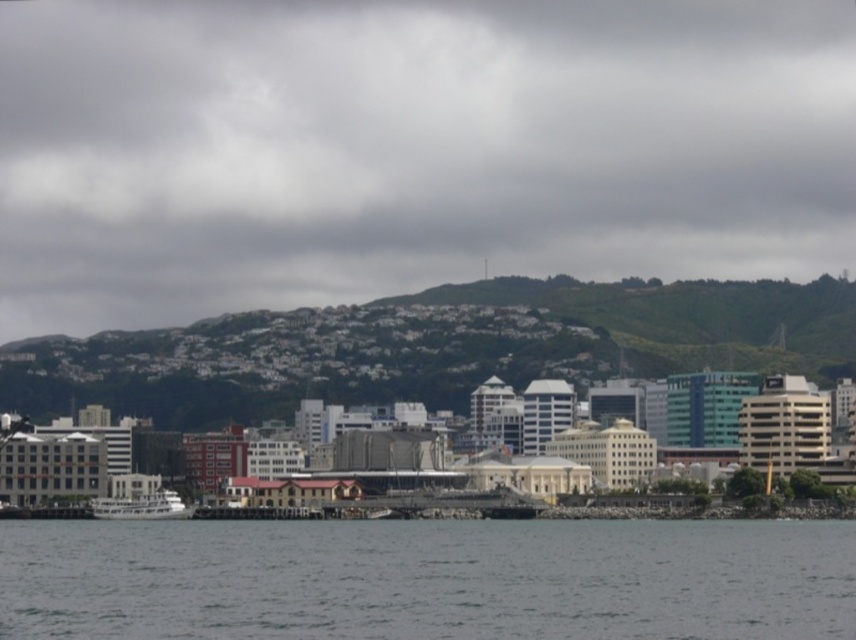
You are standing on the dock looking at the green grassy hill at upper center and the white matte boat at lower left. Which object is wider?

The green grassy hill at upper center is wider than the white matte boat at lower left according to the description.

You are a photographer planning to capture the white matte boat at lower left and the gray water at lower center in a single frame. Based on their positions, which object should you position closer to the left side of your camera viewfinder?

The white matte boat at lower left should be positioned closer to the left side of the camera viewfinder since it is located to the left of the gray water at lower center.